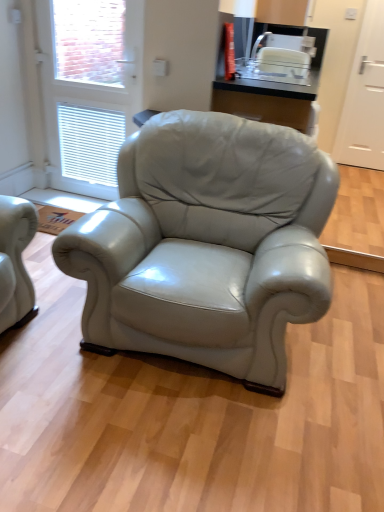
Question: Is white glossy screen door at upper left, which appears as the 1th screen door when viewed from the front, outside of white plastic toaster at upper center?

Choices:
 (A) no
 (B) yes

Answer: (B)

Question: From a real-world perspective, is white glossy screen door at upper left, which appears as the 1th screen door when viewed from the front, over white plastic toaster at upper center?

Choices:
 (A) no
 (B) yes

Answer: (A)

Question: Is white glossy screen door at upper left, the 2th screen door positioned from the back, shorter than white plastic toaster at upper center?

Choices:
 (A) no
 (B) yes

Answer: (A)

Question: Considering the relative sizes of white glossy screen door at upper left, the 2th screen door positioned from the back, and white plastic toaster at upper center in the image provided, is white glossy screen door at upper left, the 2th screen door positioned from the back, bigger than white plastic toaster at upper center?

Choices:
 (A) yes
 (B) no

Answer: (A)

Question: Does white glossy screen door at upper left, which appears as the 1th screen door when viewed from the front, touch white plastic toaster at upper center?

Choices:
 (A) no
 (B) yes

Answer: (A)

Question: Is point 251,57 closer or farther from the camera than point 87,39?

Choices:
 (A) farther
 (B) closer

Answer: (A)

Question: In terms of size, does white plastic toaster at upper center appear bigger or smaller than white glossy screen door at upper left, placed as the 2th screen door when sorted from right to left?

Choices:
 (A) big
 (B) small

Answer: (B)

Question: From a real-world perspective, is white plastic toaster at upper center positioned above or below white glossy screen door at upper left, placed as the 2th screen door when sorted from right to left?

Choices:
 (A) below
 (B) above

Answer: (B)

Question: Is white plastic toaster at upper center taller or shorter than white glossy screen door at upper left, the first screen door when ordered from left to right?

Choices:
 (A) short
 (B) tall

Answer: (A)

Question: Considering their positions, is white glossy screen door at upper left, placed as the 2th screen door when sorted from right to left, located in front of or behind white matte door at right, the 1th screen door from the right?

Choices:
 (A) behind
 (B) front

Answer: (B)

Question: From a real-world perspective, is white glossy screen door at upper left, the first screen door when ordered from left to right, physically located above or below white matte door at right, positioned as the first screen door in back-to-front order?

Choices:
 (A) below
 (B) above

Answer: (A)

Question: In terms of width, does white glossy screen door at upper left, which appears as the 1th screen door when viewed from the front, look wider or thinner when compared to white matte door at right, the 1th screen door from the right?

Choices:
 (A) thin
 (B) wide

Answer: (B)

Question: In the image, is white glossy screen door at upper left, placed as the 2th screen door when sorted from right to left, on the left side or the right side of white matte door at right, the second screen door viewed from the front?

Choices:
 (A) left
 (B) right

Answer: (A)

Question: From the image's perspective, relative to white glossy screen door at upper left, placed as the 2th screen door when sorted from right to left, is white matte door at right, acting as the 2th screen door starting from the left, above or below?

Choices:
 (A) below
 (B) above

Answer: (B)

Question: Is point (365, 155) positioned closer to the camera than point (87, 45)?

Choices:
 (A) closer
 (B) farther

Answer: (B)